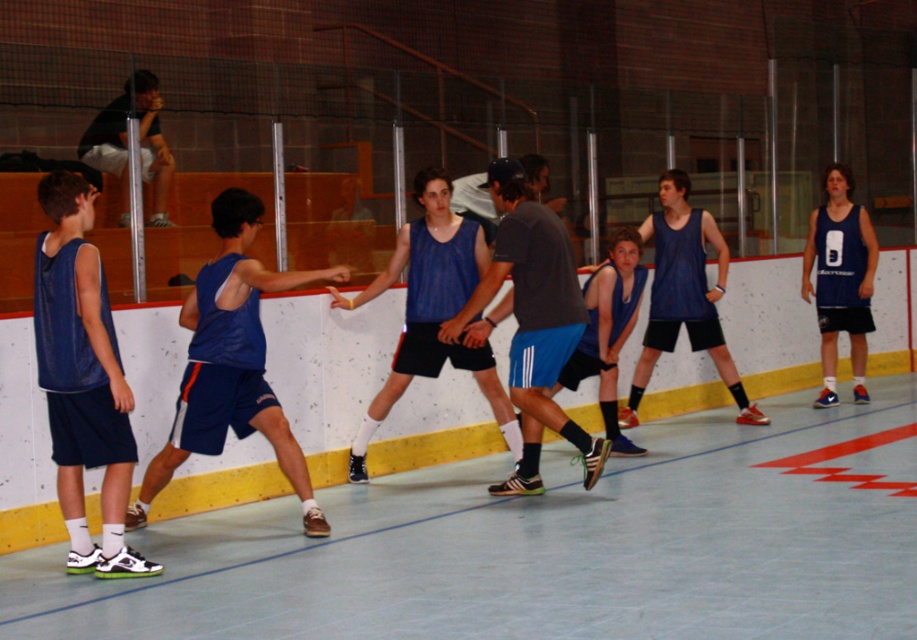
Is matte blue tank top at center wider than black jersey at upper left?

Yes, matte blue tank top at center is wider than black jersey at upper left.

Is matte blue tank top at center thinner than black jersey at upper left?

Incorrect, matte blue tank top at center's width is not less than black jersey at upper left's.

Is point (207, 403) closer to viewer compared to point (101, 170)?

Yes, point (207, 403) is in front of point (101, 170).

The width and height of the screenshot is (917, 640). What are the coordinates of `matte blue tank top at center` in the screenshot? It's located at (231, 362).

Is matte blue shorts at left below black jersey at upper left?

Yes.

Does matte blue shorts at left have a greater height compared to black jersey at upper left?

Correct, matte blue shorts at left is much taller as black jersey at upper left.

I want to click on matte blue shorts at left, so click(326, 368).

Between point (106, 413) and point (572, 307), which one is positioned behind?

Point (572, 307)

Image resolution: width=917 pixels, height=640 pixels. In order to click on matte blue tank top at left in this screenshot , I will do `click(83, 378)`.